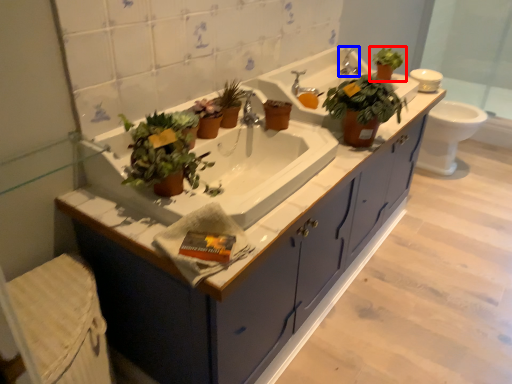
Question: Which object is further to the camera taking this photo, houseplant (highlighted by a red box) or faucet (highlighted by a blue box)?

Choices:
 (A) houseplant
 (B) faucet

Answer: (B)